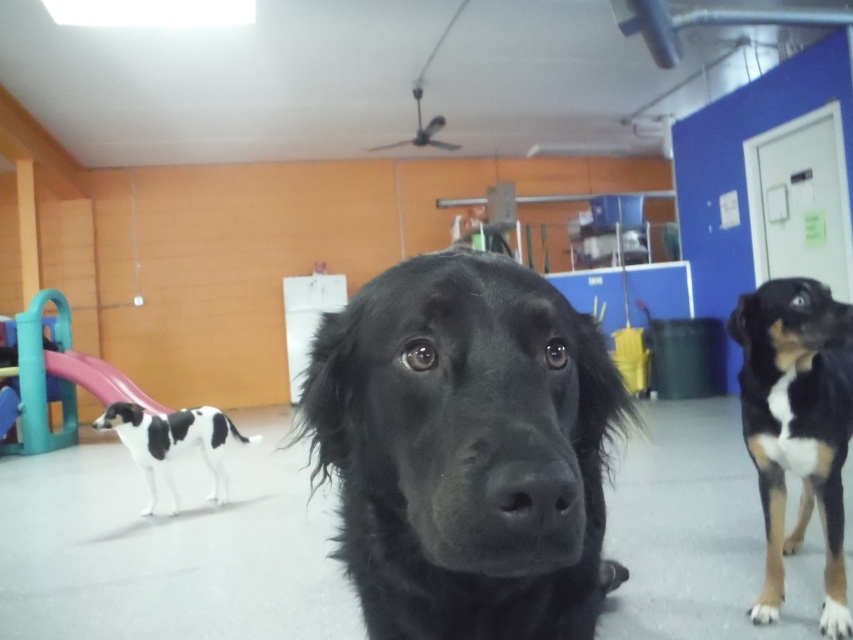
Question: Does black fur dog at center have a lesser width compared to brown and white fur dog at center?

Choices:
 (A) no
 (B) yes

Answer: (B)

Question: Is black fur dog at center bigger than black and white fur dog at left?

Choices:
 (A) no
 (B) yes

Answer: (A)

Question: Among these objects, which one is farthest from the camera?

Choices:
 (A) black fur dog at center
 (B) black and white fur dog at left

Answer: (B)

Question: Does brown and white fur dog at center appear on the right side of black and white fur dog at left?

Choices:
 (A) no
 (B) yes

Answer: (B)

Question: Which of the following is the closest to the observer?

Choices:
 (A) (183, 449)
 (B) (514, 484)

Answer: (B)

Question: Which of the following is the closest to the observer?

Choices:
 (A) (526, 602)
 (B) (843, 324)

Answer: (A)